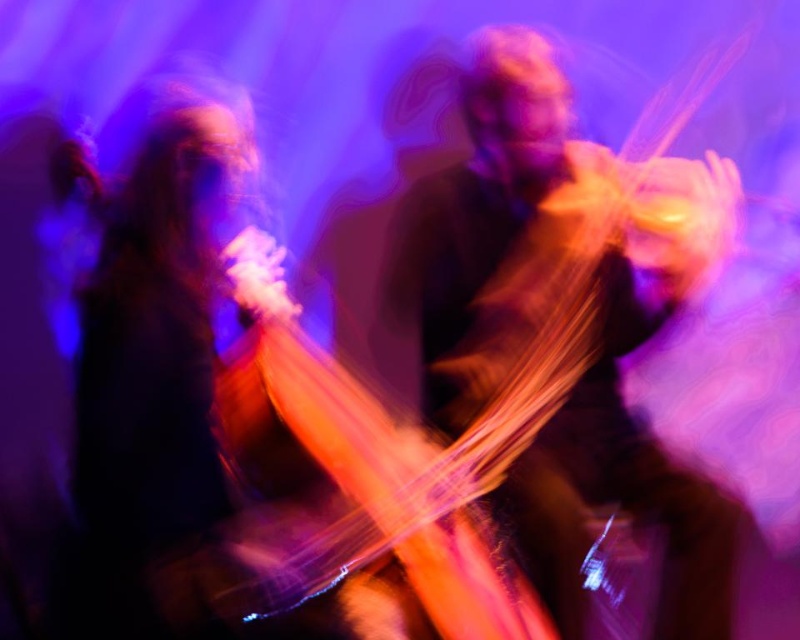
You are a photographer trying to capture the shiny black guitar at left in a clear shot. The camera is focused at point 0.5, 0.2. Will the guitar be in focus?

The shiny black guitar at left is located at point [152,339], which is close to the camera focus point of [160,320]. Therefore, the guitar will likely be in focus.

You are a stagehand setting up for a performance. You need to place a stand for the shiny black guitar at left and the translucent orange cello at center. Given their sizes, which instrument requires a taller stand?

The shiny black guitar at left requires a taller stand because it is much taller than the translucent orange cello at center according to the description.

You are a photographer trying to capture a clear shot of both the wooden violin at center and the shiny black guitar at left. Since the scene has motion blur, you want to adjust your camera settings to freeze the motion. Which object should you focus on first to ensure it stays sharp in the photo?

The wooden violin at center should be focused on first because it is closer to the viewer than the shiny black guitar at left, so adjusting focus on it will help capture both objects more clearly.